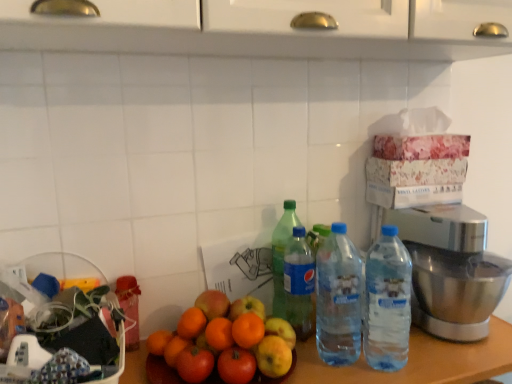
This screenshot has height=384, width=512. Find the location of `free spot above polished stainless steel mixer at right (from a real-world perspective)`. free spot above polished stainless steel mixer at right (from a real-world perspective) is located at coordinates (445, 211).